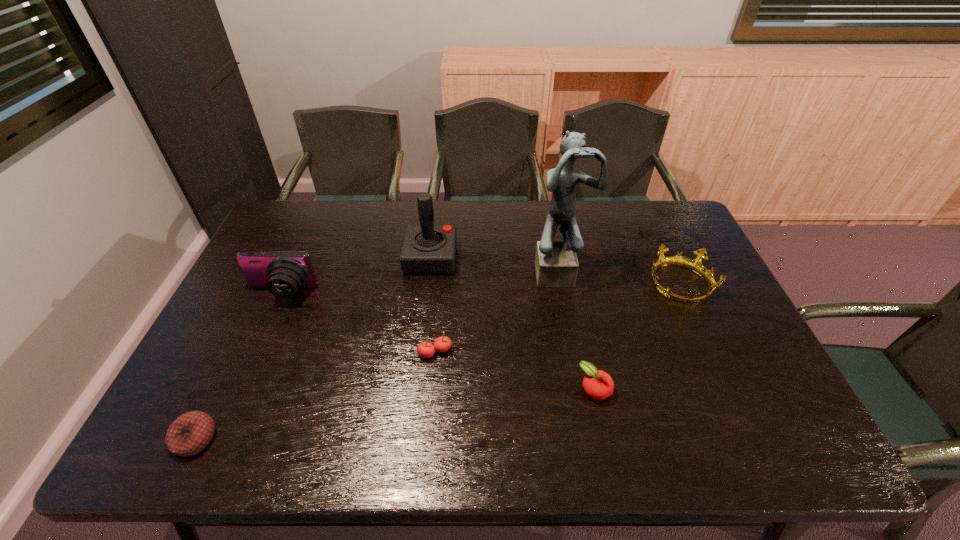
You are a GUI agent. You are given a task and a screenshot of the screen. Output one action in this format:
    pyautogui.click(x=<x>, y=<y>)
    Task: Click on the free point between the fifth farthest object and the nearest object
    
    Given the screenshot: What is the action you would take?
    pyautogui.click(x=315, y=395)

You are a GUI agent. You are given a task and a screenshot of the screen. Output one action in this format:
    pyautogui.click(x=<x>, y=<y>)
    Task: Click on the free space between the sculpture and the apple
    This screenshot has height=540, width=960.
    Given the screenshot: What is the action you would take?
    pyautogui.click(x=577, y=330)

Locate an element on the screen. This screenshot has height=540, width=960. empty location between the third tallest object and the cherry is located at coordinates (358, 323).

Identify the location of free area in between the cherry and the camera. [x=358, y=323].

The width and height of the screenshot is (960, 540). I want to click on blank region between the sixth shortest object and the tallest object, so click(494, 264).

I want to click on free area in between the joystick and the sixth farthest object, so click(513, 323).

Identify the location of free space between the sculpture and the camera. (420, 282).

This screenshot has height=540, width=960. What are the coordinates of `the fourth closest object relative to the sculpture` in the screenshot? It's located at (442, 344).

Choose which object is the nearest neighbor to the sculpture. Please provide its 2D coordinates. Your answer should be formatted as a tuple, i.e. [(x, y)], where the tuple contains the x and y coordinates of a point satisfying the conditions above.

[(695, 265)]

Locate an element on the screen. free space that satisfies the following two spatial constraints: 1. on the back side of the apple; 2. on the left side of the crown is located at coordinates (572, 285).